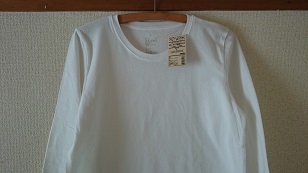
The width and height of the screenshot is (308, 173). I want to click on hanger hook, so click(153, 4).